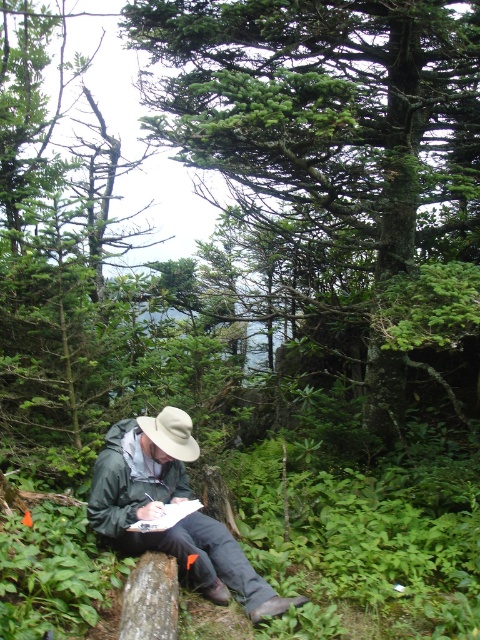
Is green matte jacket at center positioned before white felt fedora at center?

Yes, green matte jacket at center is in front of white felt fedora at center.

In the scene shown: Does green matte jacket at center have a smaller size compared to white felt fedora at center?

No.

Between point (123, 540) and point (165, 413), which one is positioned behind?

Positioned behind is point (165, 413).

Identify the location of green matte jacket at center. The image size is (480, 640). (172, 502).

In the scene shown: Is green leafy tree at center closer to the viewer compared to green matte jacket at center?

No, it is behind green matte jacket at center.

Based on the photo, is green leafy tree at center smaller than green matte jacket at center?

Incorrect, green leafy tree at center is not smaller in size than green matte jacket at center.

Is point (295, 317) farther from camera compared to point (184, 548)?

Yes.

Where is `green leafy tree at center`? green leafy tree at center is located at coordinates (336, 177).

Does point (337, 308) come closer to viewer compared to point (190, 417)?

No, (337, 308) is further to viewer.

Does green leafy tree at center appear on the right side of white felt fedora at center?

Correct, you'll find green leafy tree at center to the right of white felt fedora at center.

Between point (441, 173) and point (192, 440), which one is positioned in front?

Positioned in front is point (192, 440).

What are the coordinates of `green leafy tree at center` in the screenshot? It's located at (336, 177).